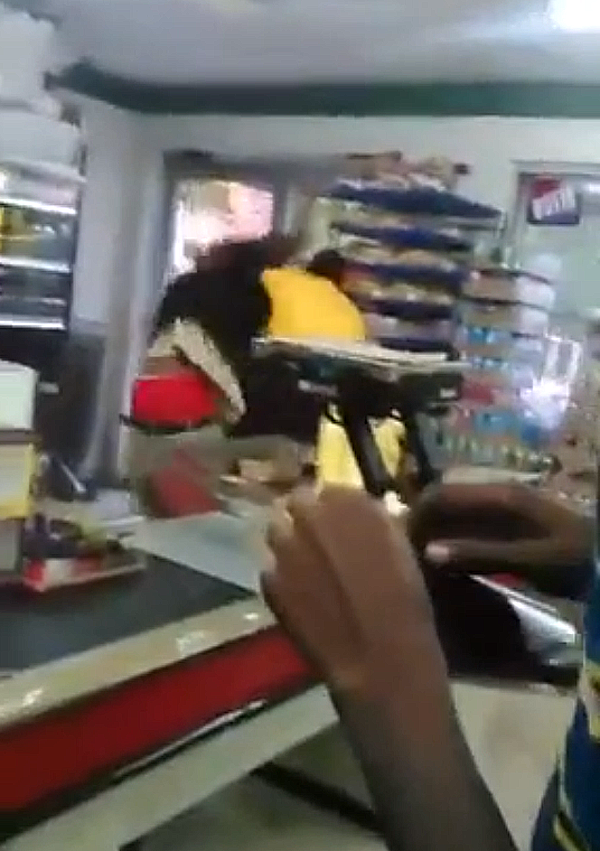
Locate an element on the screen. Image resolution: width=600 pixels, height=851 pixels. red topper of plastic container on table is located at coordinates (158, 391).